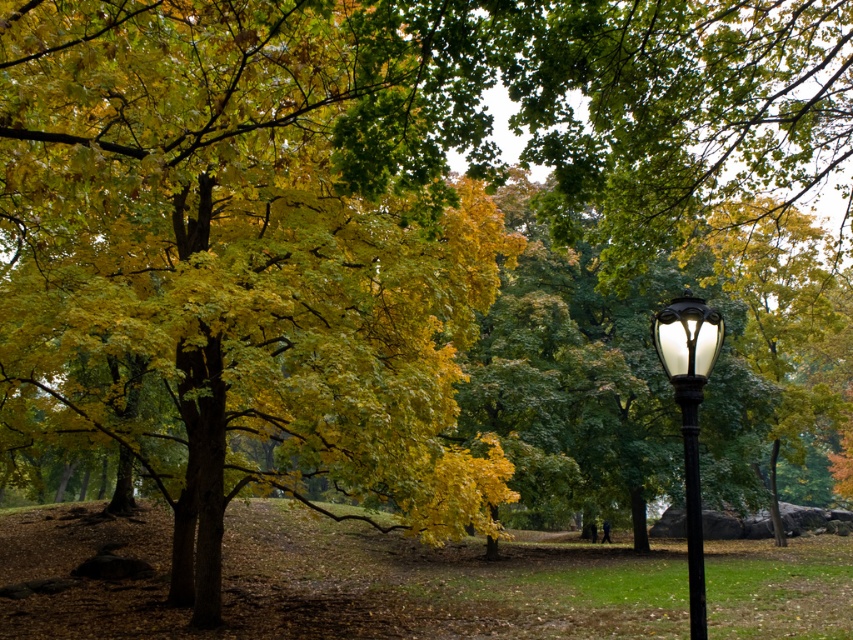
You are a city planner assessing the park layout. You notice the black metal lamp post at right and the black polished metal pole at right. Which one is taller?

The black metal lamp post at right is taller than the black polished metal pole at right.

You are a city planner assessing the park layout. You notice two black metal structures at the right side of the park. Which one is wider between the black metal lamp post at right and the black polished metal pole at right?

The black metal lamp post at right is wider than the black polished metal pole at right.

You are a city planner reviewing the park layout. You notice the black metal lamp post at right and the black polished metal pole at right. Which one is bigger?

The black metal lamp post at right is larger in size than the black polished metal pole at right.